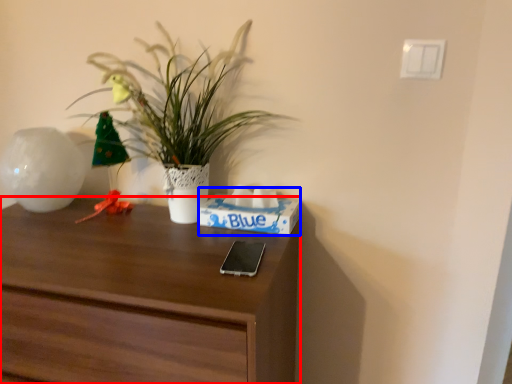
Question: Which point is further to the camera, desk (highlighted by a red box) or shoe box (highlighted by a blue box)?

Choices:
 (A) desk
 (B) shoe box

Answer: (B)